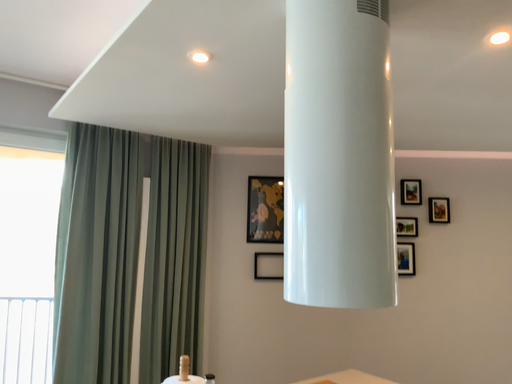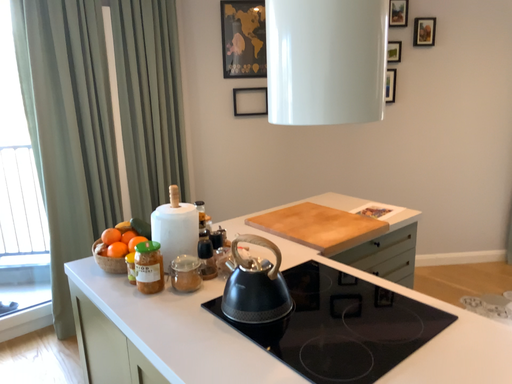
Question: How did the camera likely rotate when shooting the video?

Choices:
 (A) rotated upward
 (B) rotated downward

Answer: (B)